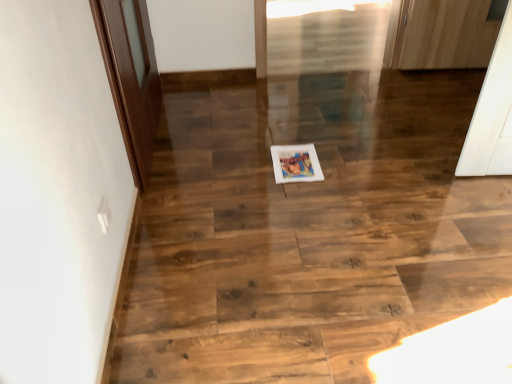
Locate an element on the screen. vacant region above matte paper postcard at center (from a real-world perspective) is located at coordinates (294, 158).